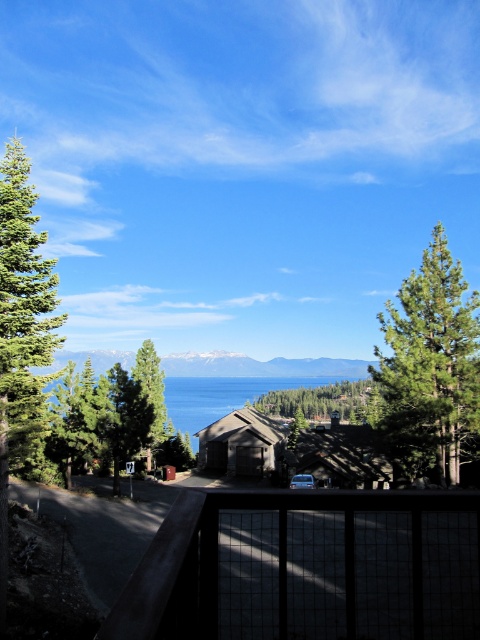
Question: Does green textured pine tree at right have a greater width compared to matte brown cabin at center?

Choices:
 (A) yes
 (B) no

Answer: (A)

Question: Considering the real-world distances, which object is farthest from the green textured tree at center?

Choices:
 (A) dark gray grid-patterned deck at center
 (B) green matte tree at center
 (C) matte brown cabin at center
 (D) blue water at center

Answer: (A)

Question: Is matte brown cabin at center further to the viewer compared to green textured tree at center?

Choices:
 (A) no
 (B) yes

Answer: (A)

Question: Which object is the closest to the green textured tree at center?

Choices:
 (A) green textured pine tree at right
 (B) green matte evergreen tree at left
 (C) green matte tree at center
 (D) brown wood cabin at center

Answer: (A)

Question: Can you confirm if green textured pine tree at right is thinner than green matte evergreen tree at left?

Choices:
 (A) yes
 (B) no

Answer: (A)

Question: Considering the real-world distances, which object is farthest from the brown wood cabin at center?

Choices:
 (A) green matte tree at center
 (B) green textured pine tree at right

Answer: (B)